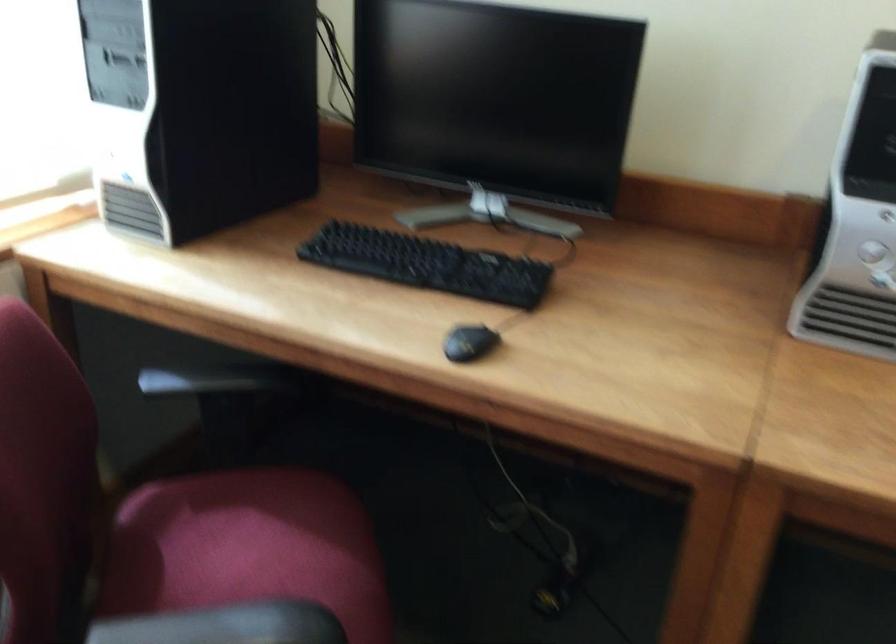
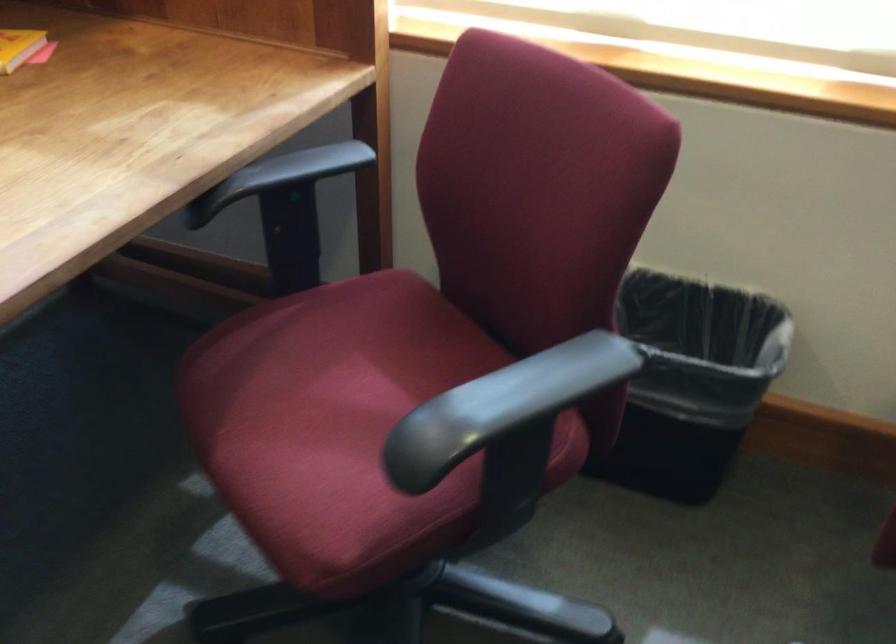
The first image is from the beginning of the video and the second image is from the end. How did the camera likely rotate when shooting the video?

The camera's rotation is toward left-down.